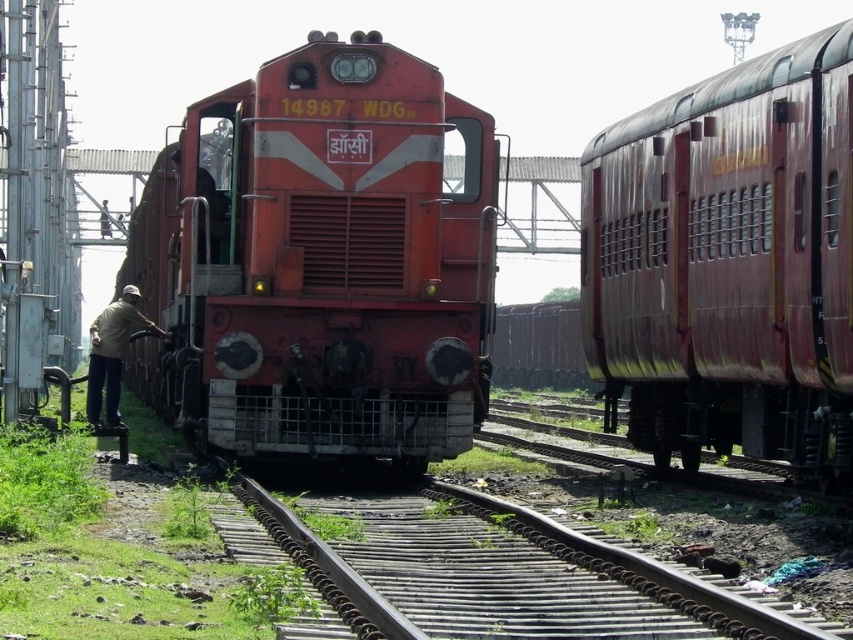
Can you confirm if matte red locomotive at center is smaller than light brown fabric cap at left?

Actually, matte red locomotive at center might be larger than light brown fabric cap at left.

Based on the photo, who is more distant from viewer, (x=149, y=404) or (x=105, y=353)?

Point (x=149, y=404)

Locate an element on the screen. This screenshot has height=640, width=853. matte red locomotive at center is located at coordinates (321, 260).

Who is positioned more to the right, matte red locomotive at center or rusty metal train car at right?

rusty metal train car at right

Between point (142, 280) and point (834, 390), which one is positioned behind?

The point (142, 280) is more distant.

Find the location of a particular element. matte red locomotive at center is located at coordinates (321, 260).

You are a GUI agent. You are given a task and a screenshot of the screen. Output one action in this format:
    pyautogui.click(x=<x>, y=<y>)
    Task: Click on the matte red locomotive at center
    This screenshot has width=853, height=640.
    Given the screenshot: What is the action you would take?
    pyautogui.click(x=321, y=260)

Who is higher up, matte red locomotive at center or rusty metal train track at center?

matte red locomotive at center is above.

Find the location of a particular element. The image size is (853, 640). matte red locomotive at center is located at coordinates (321, 260).

The height and width of the screenshot is (640, 853). I want to click on matte red locomotive at center, so click(321, 260).